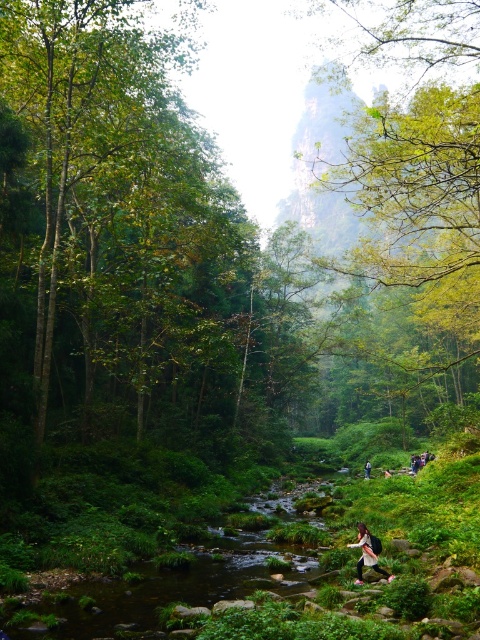
From the picture: Does dark brown leather backpack at lower center lie behind dark blue jeans at lower center?

No.

Can you confirm if dark brown leather backpack at lower center is smaller than dark blue jeans at lower center?

Yes, dark brown leather backpack at lower center is smaller than dark blue jeans at lower center.

Who is more distant from viewer, (364, 554) or (365, 467)?

Point (365, 467)

At what (x,y) coordinates should I click in order to perform the action: click on dark brown leather backpack at lower center. Please return your answer as a coordinate pair (x, y). This screenshot has height=640, width=480. Looking at the image, I should click on (368, 554).